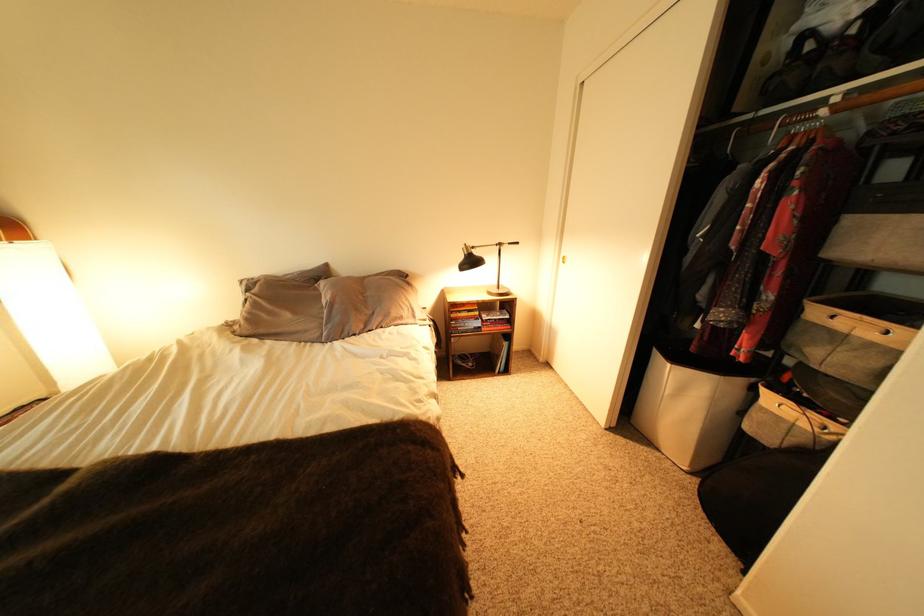
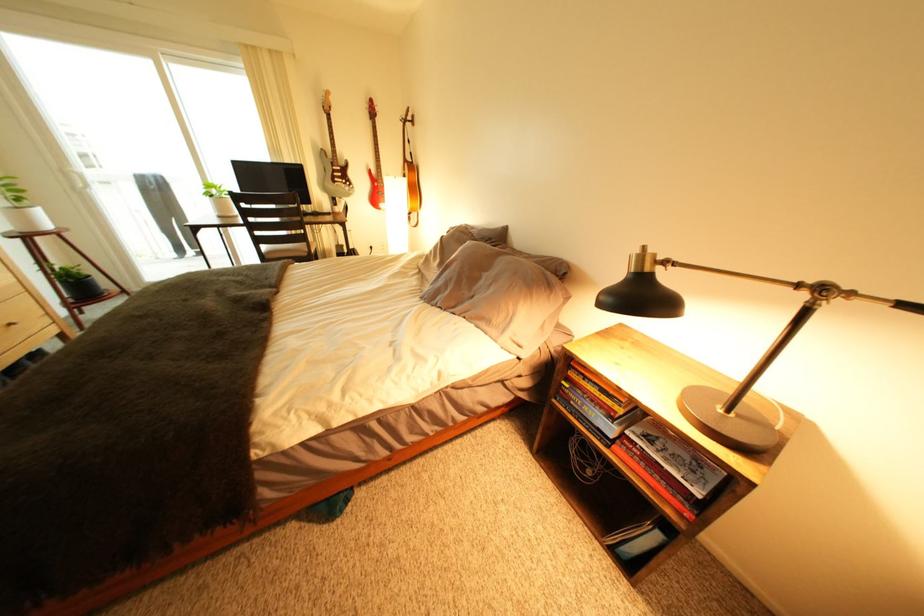
Locate, in the second image, the point that corresponds to the point at 477,248 in the first image.

(650, 253)